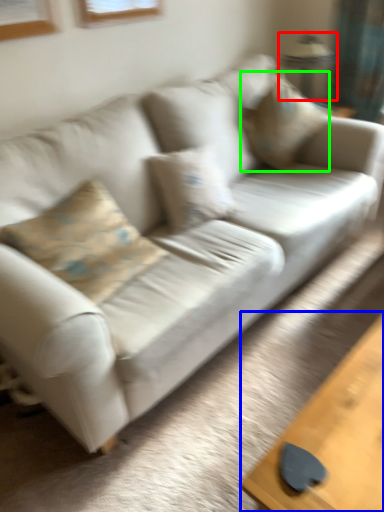
Question: Considering the real-world distances, which object is farthest from lamp (highlighted by a red box)? table (highlighted by a blue box) or pillow (highlighted by a green box)?

Choices:
 (A) table
 (B) pillow

Answer: (A)